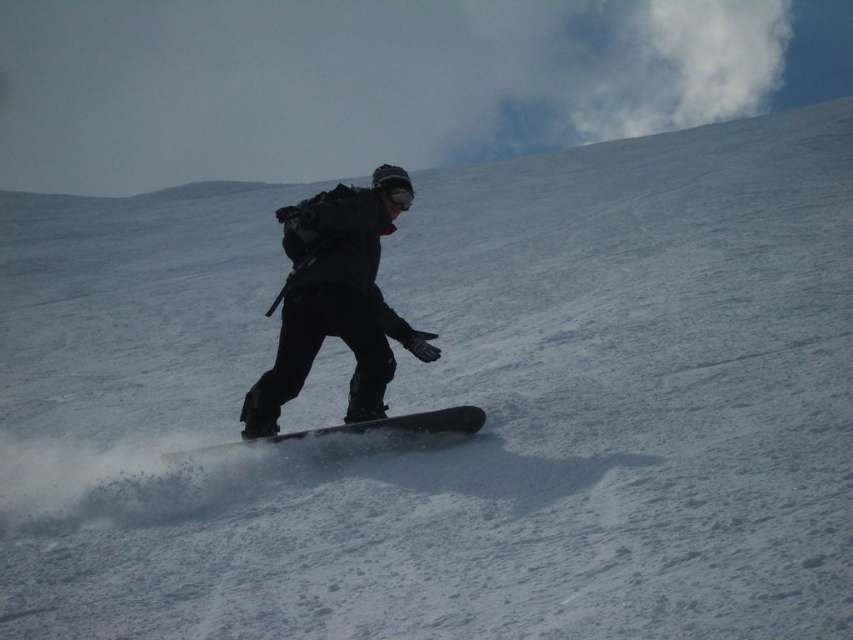
Question: Is black matte snowboarder at center smaller than black matte snowboard at center?

Choices:
 (A) yes
 (B) no

Answer: (B)

Question: Is black matte snowboarder at center positioned before black matte snowboard at center?

Choices:
 (A) yes
 (B) no

Answer: (B)

Question: Which point is closer to the camera taking this photo?

Choices:
 (A) (370, 202)
 (B) (402, 426)

Answer: (B)

Question: Is black matte snowboarder at center closer to the viewer compared to black matte snowboard at center?

Choices:
 (A) yes
 (B) no

Answer: (B)

Question: Which object is closer to the camera taking this photo?

Choices:
 (A) black matte snowboard at center
 (B) black matte snowboarder at center

Answer: (A)